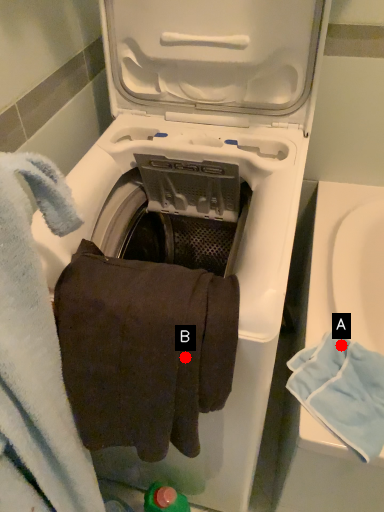
Question: Two points are circled on the image, labeled by A and B beside each circle. Which point is closer to the camera?

Choices:
 (A) A is closer
 (B) B is closer

Answer: (B)